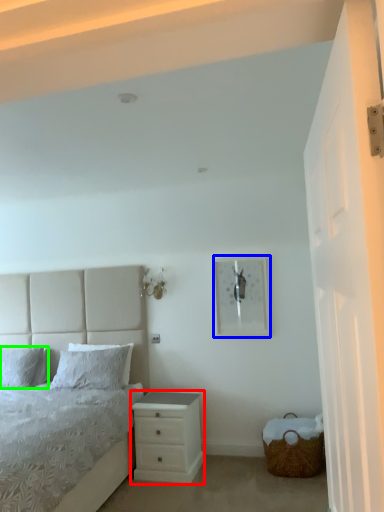
Question: Which object is positioned closest to chest of drawers (highlighted by a red box)? Select from picture frame (highlighted by a blue box) and pillow (highlighted by a green box).

Choices:
 (A) picture frame
 (B) pillow

Answer: (A)